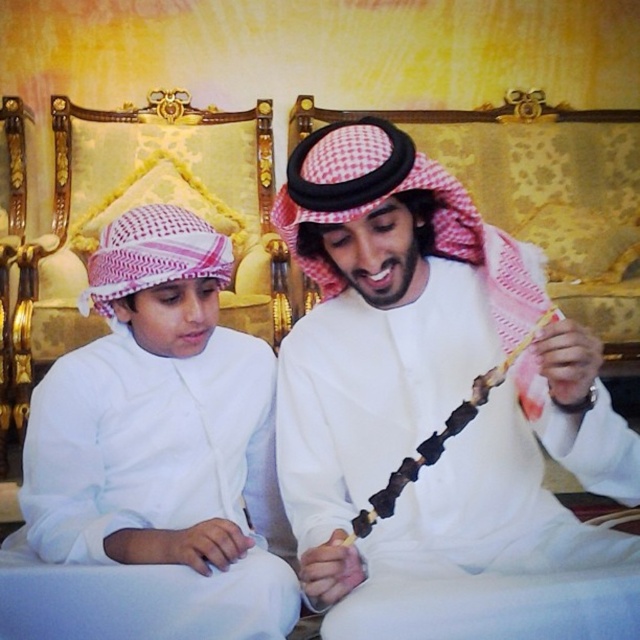
You are a chef preparing a meal and need to place the white matte kebab skewer at center and the white matte keffiyeh at center on a shelf. The shelf has a height limit of 15 cm. Can both items fit vertically without exceeding the height limit?

The white matte kebab skewer at center is much taller than the white matte keffiyeh at center. Since the shelf has a height limit of 15 cm, only the shorter item might fit. However, without knowing the exact heights, it is impossible to determine if both can fit vertically without exceeding the limit.

From the picture: You are a chef preparing a dish and need to place the white matte kebab skewer at center and the white matte keffiyeh at center on a narrow shelf. Which item should you place first to ensure both fit on the shelf?

The white matte kebab skewer at center might be wider than white matte keffiyeh at center, so you should place the kebab skewer first to ensure both items fit on the narrow shelf.

You are a photographer trying to capture a closeup of the white matte kebab skewer at center without the white matte keffiyeh at center appearing in the frame. Is this possible given their positions?

The white matte kebab skewer at center is positioned over the white matte keffiyeh at center, so it is not possible to capture the kebab skewer without the keffiyeh appearing in the frame.